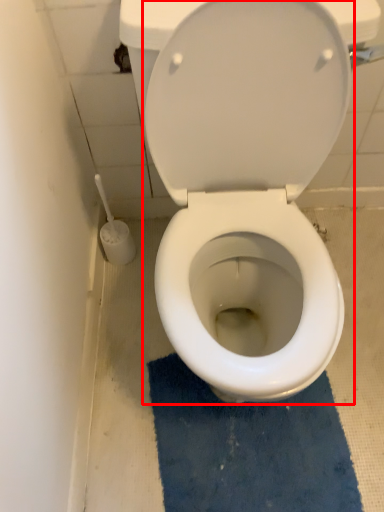
Question: Considering the relative positions of toilet (annotated by the red box) and bath mat in the image provided, where is toilet (annotated by the red box) located with respect to the staircase?

Choices:
 (A) right
 (B) left

Answer: (B)